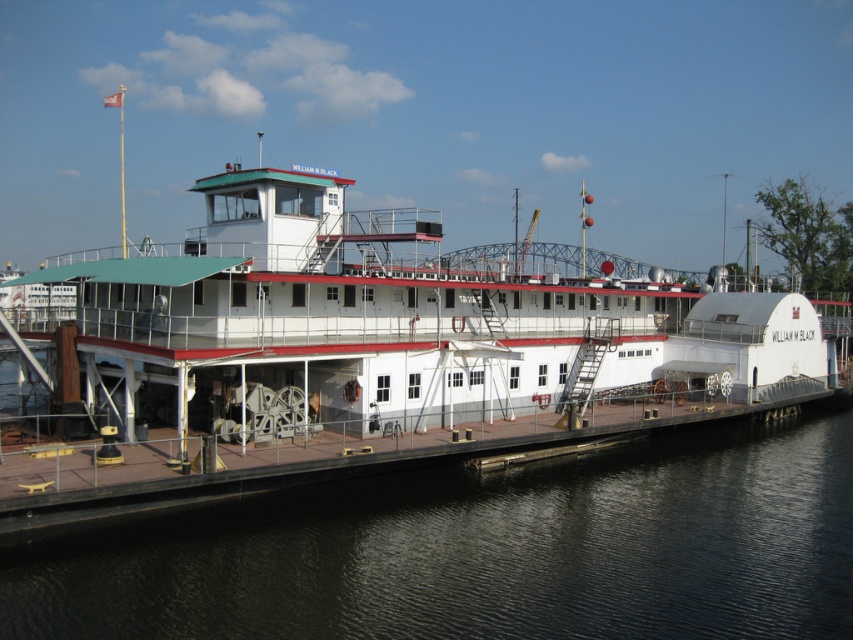
Question: Which of the following is the closest to the observer?

Choices:
 (A) (407, 298)
 (B) (184, 634)

Answer: (B)

Question: Is white matte boat at center wider than black water at lower left?

Choices:
 (A) yes
 (B) no

Answer: (A)

Question: Observing the image, what is the correct spatial positioning of white matte boat at center in reference to black water at lower left?

Choices:
 (A) right
 (B) left

Answer: (B)

Question: Which point is closer to the camera?

Choices:
 (A) black water at lower left
 (B) white matte boat at center

Answer: (A)

Question: Is white matte boat at center further to the viewer compared to black water at lower left?

Choices:
 (A) yes
 (B) no

Answer: (A)